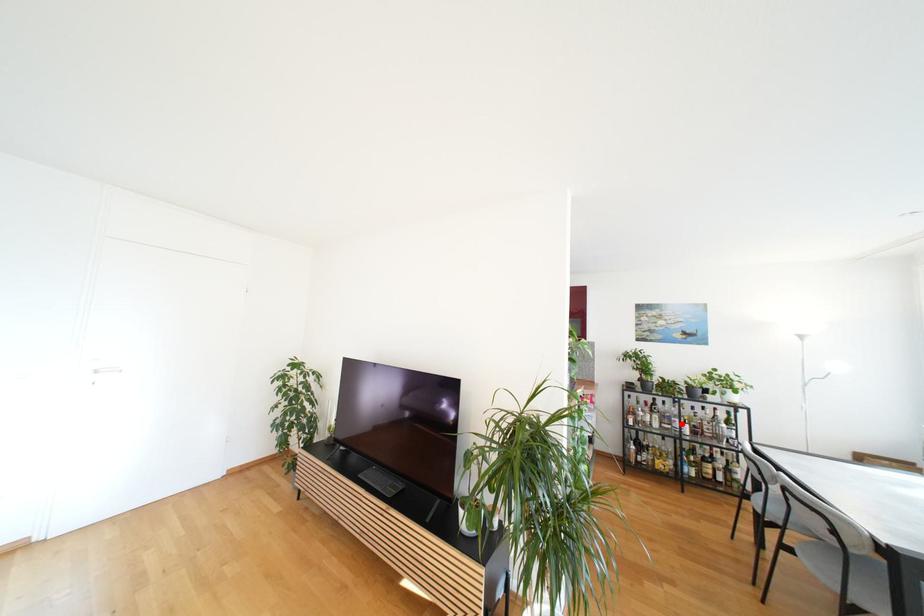
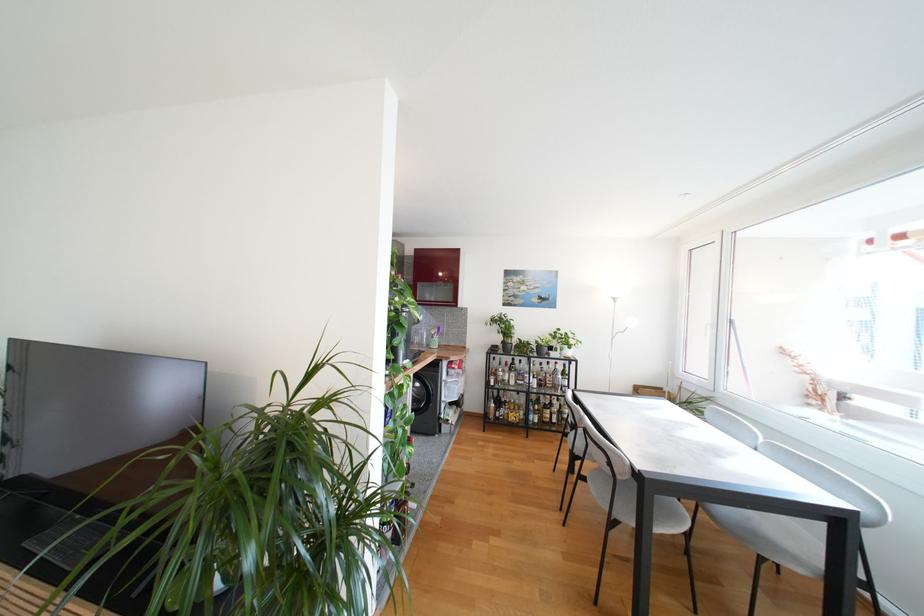
The point at the highlighted location is marked in the first image. Where is the corresponding point in the second image?

(532, 379)